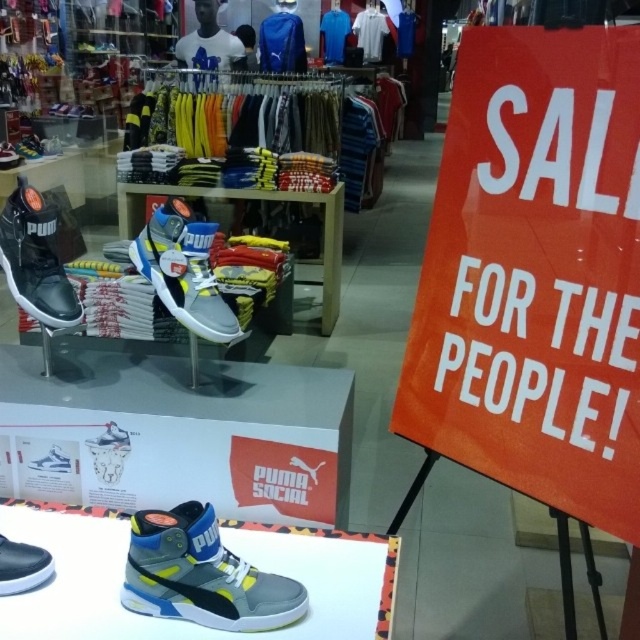
Is orange paper sign at center right shorter than matte gray sneaker at center?

No.

The width and height of the screenshot is (640, 640). I want to click on orange paper sign at center right, so click(536, 273).

I want to click on orange paper sign at center right, so click(x=536, y=273).

Which is more to the left, gray/yellow suede sneaker at center or black matte sneaker at left?

From the viewer's perspective, black matte sneaker at left appears more on the left side.

Measure the distance between gray/yellow suede sneaker at center and black matte sneaker at left.

gray/yellow suede sneaker at center is 22.98 inches from black matte sneaker at left.

At what (x,y) coordinates should I click in order to perform the action: click on gray/yellow suede sneaker at center. Please return your answer as a coordinate pair (x, y). Looking at the image, I should click on (202, 573).

Based on the photo, is gray/yellow suede sneaker at center smaller than gray matte sneaker at center?

Indeed, gray/yellow suede sneaker at center has a smaller size compared to gray matte sneaker at center.

Can you confirm if gray/yellow suede sneaker at center is positioned to the right of gray matte sneaker at center?

Correct, you'll find gray/yellow suede sneaker at center to the right of gray matte sneaker at center.

Describe the element at coordinates (202, 573) in the screenshot. I see `gray/yellow suede sneaker at center` at that location.

Identify the location of gray/yellow suede sneaker at center. (202, 573).